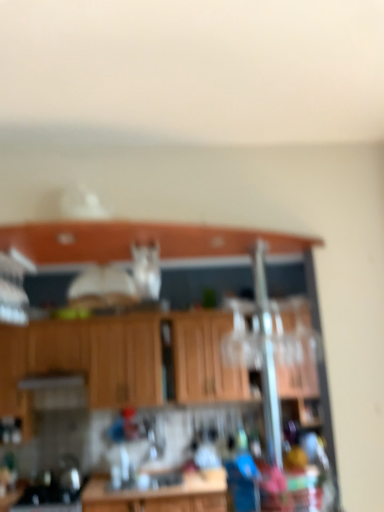
Question: Is point (148, 229) closer or farther from the camera than point (190, 323)?

Choices:
 (A) closer
 (B) farther

Answer: (A)

Question: In terms of width, does wooden cabinet at upper center look wider or thinner when compared to wooden cabinets at center?

Choices:
 (A) thin
 (B) wide

Answer: (B)

Question: From a real-world perspective, is wooden cabinet at upper center above or below wooden cabinets at center?

Choices:
 (A) above
 (B) below

Answer: (A)

Question: Considering their positions, is wooden cabinets at center located in front of or behind wooden cabinet at upper center?

Choices:
 (A) front
 (B) behind

Answer: (B)

Question: In terms of width, does wooden cabinets at center look wider or thinner when compared to wooden cabinet at upper center?

Choices:
 (A) thin
 (B) wide

Answer: (A)

Question: Is point (66, 355) closer or farther from the camera than point (44, 246)?

Choices:
 (A) farther
 (B) closer

Answer: (A)

Question: From their relative heights in the image, would you say wooden cabinets at center is taller or shorter than wooden cabinet at upper center?

Choices:
 (A) tall
 (B) short

Answer: (A)